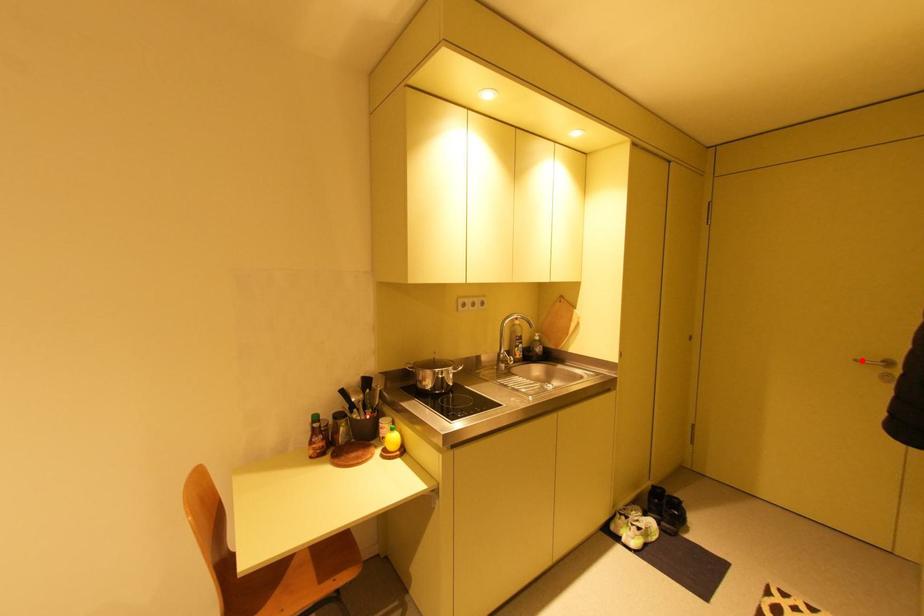
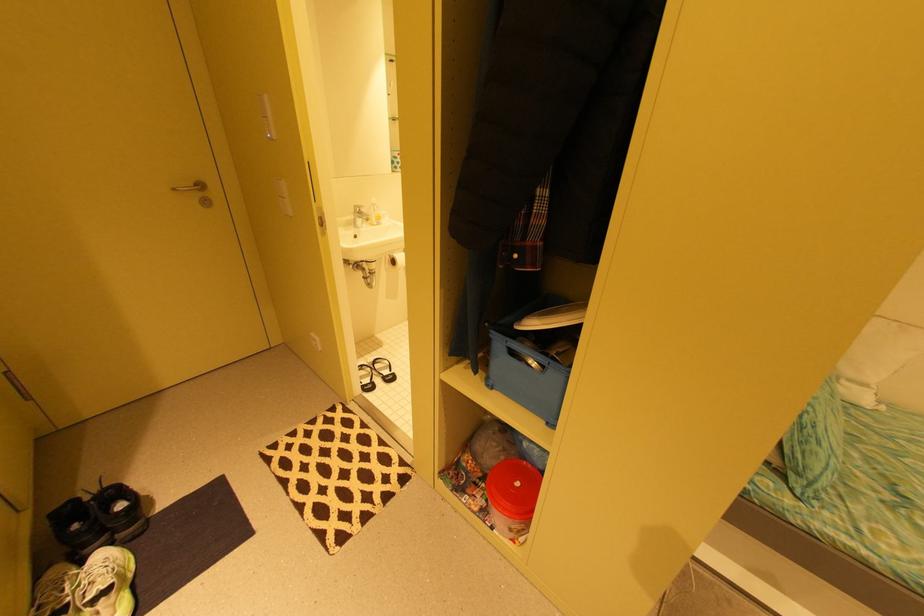
Find the pixel in the second image that matches the highlighted location in the first image.

(179, 190)